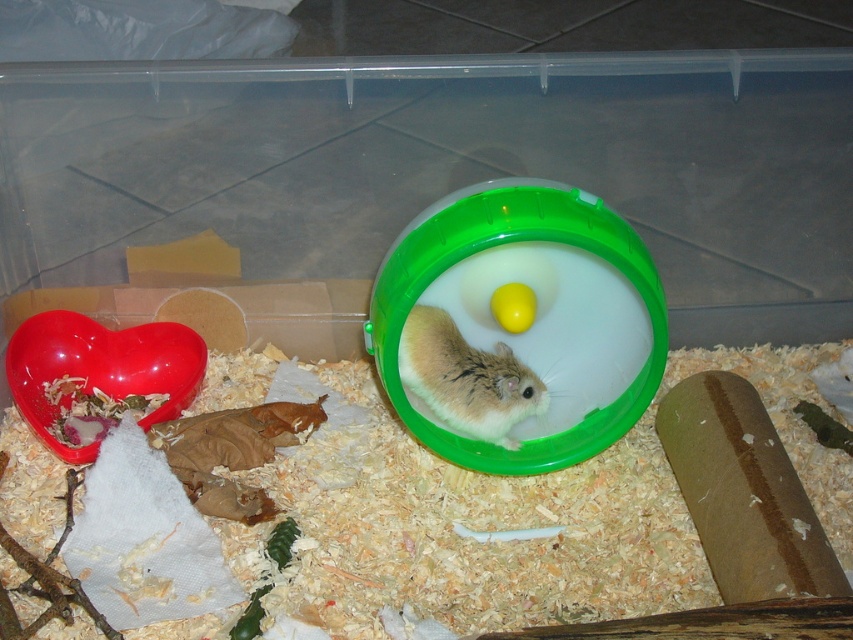
You are a pet owner who wants to place a new toy in the enclosure. The toy requires a space of 4 inches to be placed safely. Can you put the toy between the white fur hamster at center and the yellow matte egg at center?

The white fur hamster at center and the yellow matte egg at center are 3.72 inches apart. Since the required space is 4 inches, the toy cannot be placed between them safely.

Based on the coordinates provided in the description, where is the white fur hamster at center located in the enclosure?

The white fur hamster at center is located at the coordinates point (466,378) in the enclosure.

You are a small pet owner looking to place a new toy in the enclosure. You have a small bell that you want to hang above the white fur hamster at center so it can play with it. Is the yellow matte egg at center currently blocking the spot where you want to hang the bell?

The white fur hamster at center is positioned under the yellow matte egg at center, so the egg is blocking the spot where you want to hang the bell above the hamster.